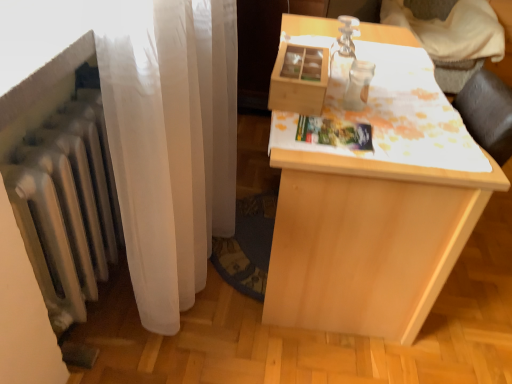
Question: From the image's perspective, is white sheer curtain at left over light wood table at center?

Choices:
 (A) no
 (B) yes

Answer: (B)

Question: Is white sheer curtain at left to the right of light wood table at center from the viewer's perspective?

Choices:
 (A) yes
 (B) no

Answer: (B)

Question: Can you confirm if white sheer curtain at left is thinner than light wood table at center?

Choices:
 (A) no
 (B) yes

Answer: (B)

Question: Is white sheer curtain at left behind light wood table at center?

Choices:
 (A) yes
 (B) no

Answer: (B)

Question: Considering the relative positions of white sheer curtain at left and light wood table at center in the image provided, is white sheer curtain at left to the left of light wood table at center from the viewer's perspective?

Choices:
 (A) no
 (B) yes

Answer: (B)

Question: Does point (443, 177) appear closer or farther from the camera than point (187, 41)?

Choices:
 (A) closer
 (B) farther

Answer: (B)

Question: From the image's perspective, relative to white sheer curtain at left, is light wood table at center above or below?

Choices:
 (A) below
 (B) above

Answer: (A)

Question: Based on their sizes in the image, would you say light wood table at center is bigger or smaller than white sheer curtain at left?

Choices:
 (A) big
 (B) small

Answer: (A)

Question: Looking at their shapes, would you say light wood table at center is wider or thinner than white sheer curtain at left?

Choices:
 (A) thin
 (B) wide

Answer: (B)

Question: From the image's perspective, relative to light wood table at center, is wooden table at upper right above or below?

Choices:
 (A) below
 (B) above

Answer: (B)

Question: Which is correct: wooden table at upper right is inside light wood table at center, or outside of it?

Choices:
 (A) outside
 (B) inside

Answer: (A)

Question: In terms of size, does wooden table at upper right appear bigger or smaller than light wood table at center?

Choices:
 (A) small
 (B) big

Answer: (A)

Question: Is wooden table at upper right taller or shorter than light wood table at center?

Choices:
 (A) tall
 (B) short

Answer: (A)

Question: In the image, is white sheer curtain at left positioned in front of or behind light wood table at center?

Choices:
 (A) behind
 (B) front

Answer: (B)

Question: Is white sheer curtain at left taller or shorter than light wood table at center?

Choices:
 (A) tall
 (B) short

Answer: (B)